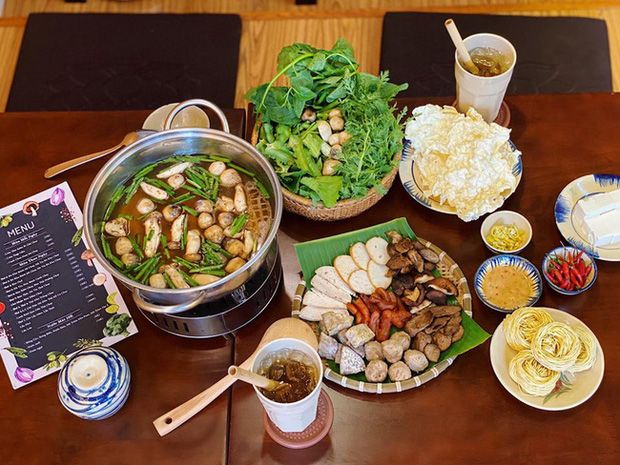
In order to click on table in this screenshot , I will do `click(519, 427)`.